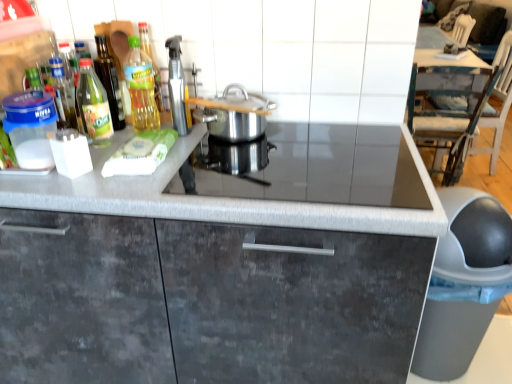
This screenshot has width=512, height=384. I want to click on vacant space in front of polished stainless steel pot at center, acting as the 1th kitchen appliance starting from the right, so click(x=243, y=162).